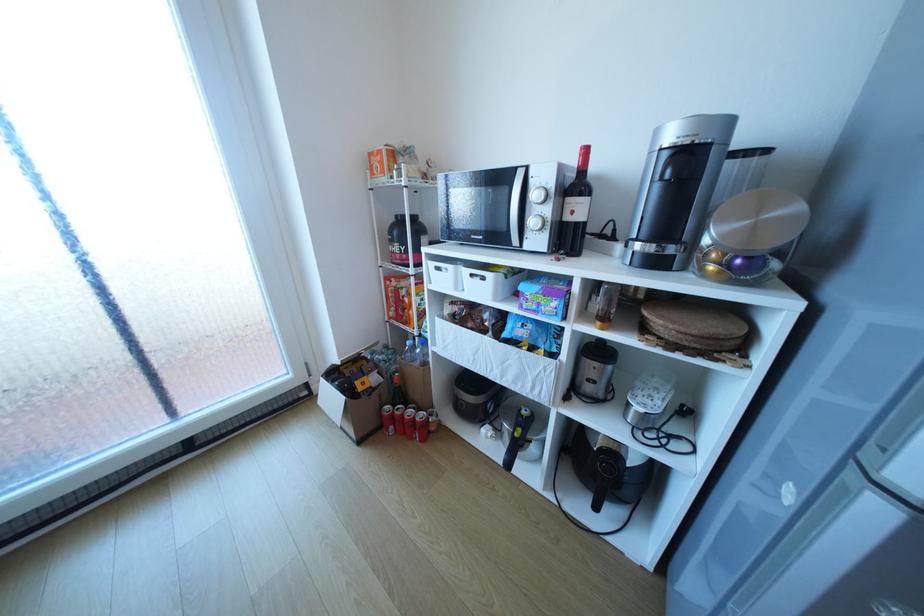
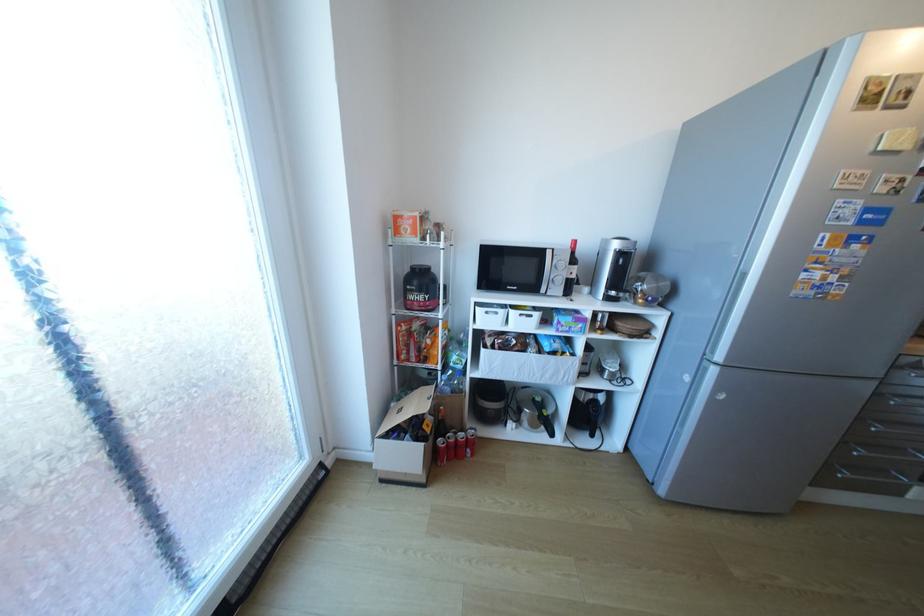
Find the pixel in the second image that matches (446,268) in the first image.

(495, 313)